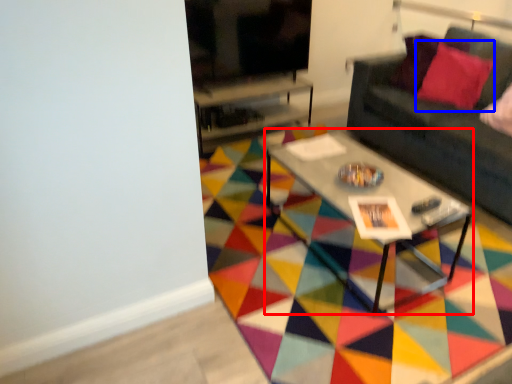
Question: Among these objects, which one is nearest to the camera, coffee table (highlighted by a red box) or throw pillow (highlighted by a blue box)?

Choices:
 (A) coffee table
 (B) throw pillow

Answer: (A)